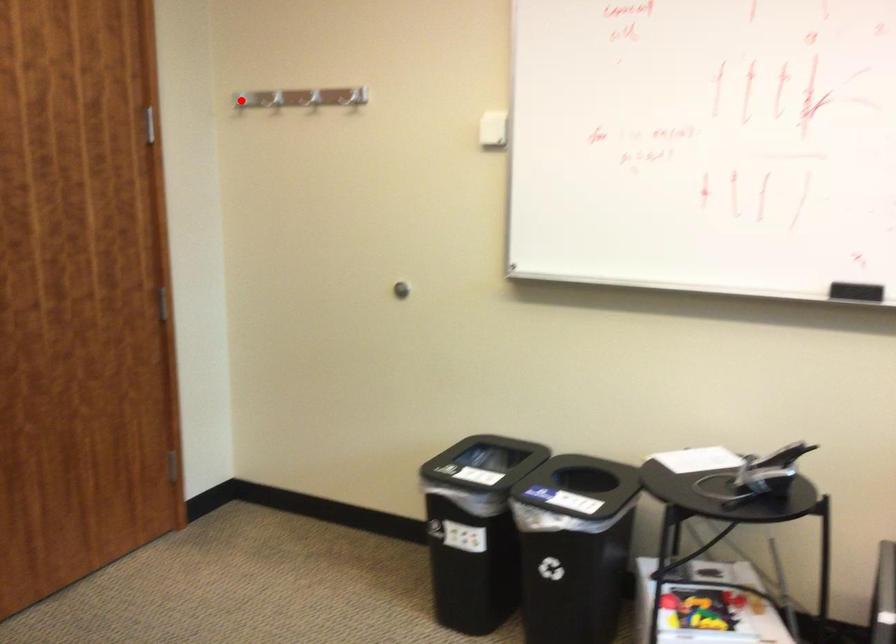
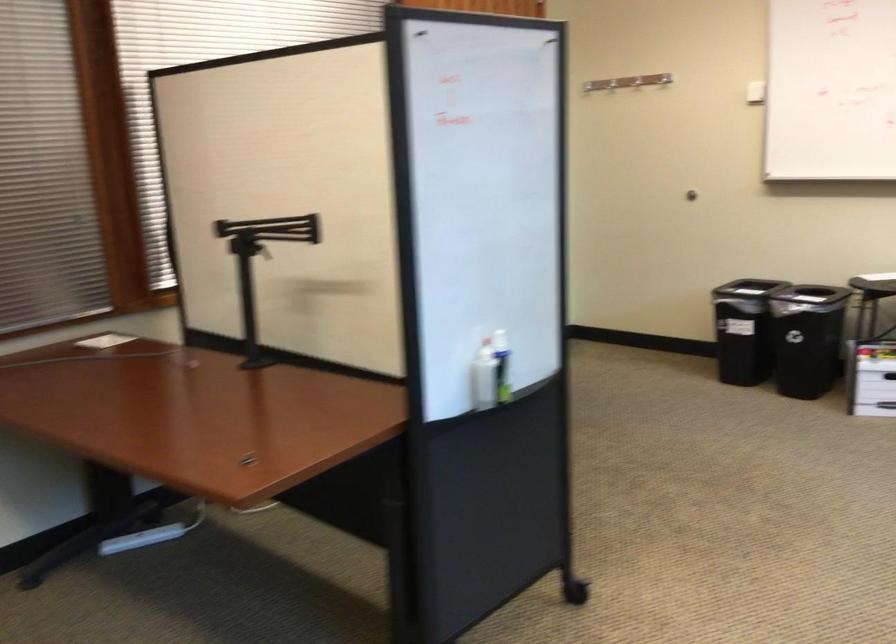
Question: I am providing you with two images of the same scene from different viewpoints. A red point is marked on the first image. Is the red point's position out of view in image 2?

Choices:
 (A) Yes
 (B) No

Answer: (A)